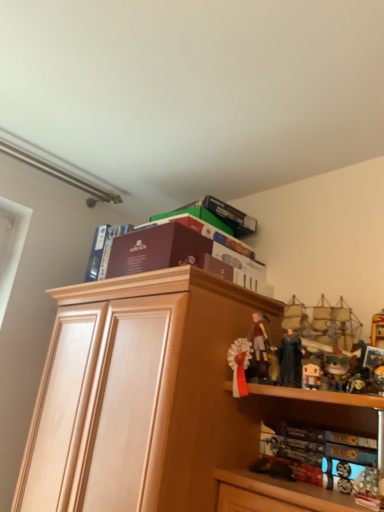
Question: From the image's perspective, would you say matte black figurine at upper right is positioned over light wood cabinet at center?

Choices:
 (A) no
 (B) yes

Answer: (B)

Question: From a real-world perspective, is matte black figurine at upper right over light wood cabinet at center?

Choices:
 (A) yes
 (B) no

Answer: (A)

Question: Is light wood cabinet at center at the back of matte black figurine at upper right?

Choices:
 (A) no
 (B) yes

Answer: (A)

Question: From a real-world perspective, is matte black figurine at upper right positioned under light wood cabinet at center based on gravity?

Choices:
 (A) no
 (B) yes

Answer: (A)

Question: Is matte black figurine at upper right shorter than light wood cabinet at center?

Choices:
 (A) no
 (B) yes

Answer: (B)

Question: Is matte black figurine at upper right taller than light wood cabinet at center?

Choices:
 (A) yes
 (B) no

Answer: (B)

Question: Is there a large distance between maroon cardboard box at upper center, the 2th book positioned from the bottom, and matte brown box at upper center, which ranks as the 1th book in top-to-bottom order?

Choices:
 (A) yes
 (B) no

Answer: (B)

Question: Is maroon cardboard box at upper center, marked as the third book in a top-to-bottom arrangement, turned away from matte brown box at upper center, which ranks as the 1th book in top-to-bottom order?

Choices:
 (A) yes
 (B) no

Answer: (A)

Question: Is maroon cardboard box at upper center, the 2th book positioned from the bottom, bigger than matte brown box at upper center, which ranks as the 1th book in top-to-bottom order?

Choices:
 (A) yes
 (B) no

Answer: (B)

Question: Does maroon cardboard box at upper center, marked as the third book in a top-to-bottom arrangement, touch matte brown box at upper center, the fourth book in the bottom-to-top sequence?

Choices:
 (A) yes
 (B) no

Answer: (A)

Question: Does maroon cardboard box at upper center, marked as the third book in a top-to-bottom arrangement, lie behind matte brown box at upper center, the fourth book in the bottom-to-top sequence?

Choices:
 (A) no
 (B) yes

Answer: (A)

Question: Could you tell me if maroon cardboard box at upper center, the 2th book positioned from the bottom, is turned towards matte brown box at upper center, the fourth book in the bottom-to-top sequence?

Choices:
 (A) no
 (B) yes

Answer: (A)

Question: Are maroon cardboard book at upper center, which appears as the third book when ordered from the bottom, and matte black figurine at upper right beside each other?

Choices:
 (A) no
 (B) yes

Answer: (A)